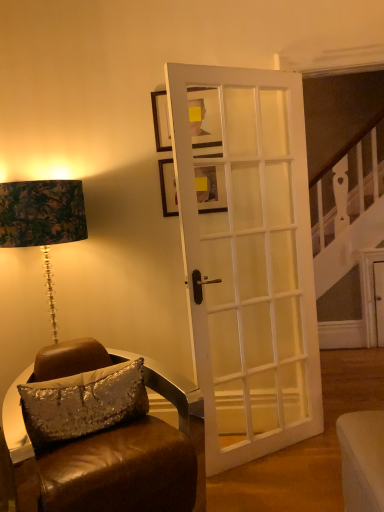
Question: Is matte black picture frame at upper center, marked as the first picture frame in a top-to-bottom arrangement, wider or thinner than white glossy door at center?

Choices:
 (A) thin
 (B) wide

Answer: (A)

Question: Considering the positions of matte black picture frame at upper center, marked as the first picture frame in a top-to-bottom arrangement, and white glossy door at center in the image, is matte black picture frame at upper center, marked as the first picture frame in a top-to-bottom arrangement, taller or shorter than white glossy door at center?

Choices:
 (A) tall
 (B) short

Answer: (B)

Question: Which of these objects is positioned farthest from the matte black picture frame at upper center, marked as the first picture frame in a top-to-bottom arrangement?

Choices:
 (A) white glossy door at center
 (B) silver sequined pillow at lower left
 (C) wooden picture frame at center, which is the 2th picture frame in top-to-bottom order
 (D) brown leather chair at lower left

Answer: (D)

Question: Estimate the real-world distances between objects in this image. Which object is closer to the wooden picture frame at center, which is the 2th picture frame in top-to-bottom order?

Choices:
 (A) white glossy door at center
 (B) silver sequined pillow at lower left
 (C) matte black picture frame at upper center, marked as the first picture frame in a top-to-bottom arrangement
 (D) brown leather chair at lower left

Answer: (C)